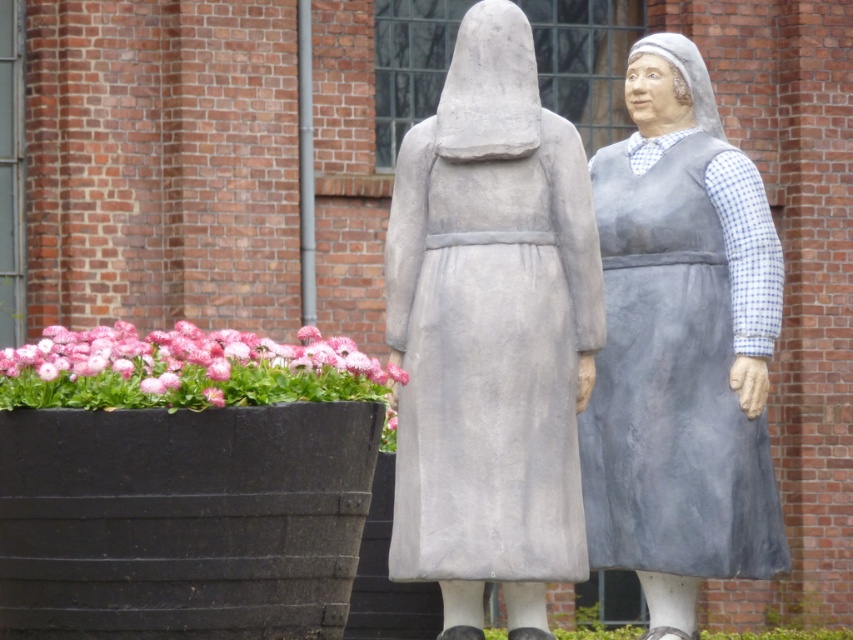
Question: Is gray stone statue at center closer to camera compared to gray fabric dress at center?

Choices:
 (A) yes
 (B) no

Answer: (A)

Question: Estimate the real-world distances between objects in this image. Which object is farther from the gray fabric dress at center?

Choices:
 (A) gray stone statue at center
 (B) pink fabric flowers at lower left

Answer: (B)

Question: Is gray stone statue at center bigger than gray fabric dress at center?

Choices:
 (A) no
 (B) yes

Answer: (B)

Question: Which point is farther to the camera?

Choices:
 (A) (601, 561)
 (B) (184, 348)

Answer: (A)

Question: Which of the following is the farthest from the observer?

Choices:
 (A) gray fabric dress at center
 (B) gray stone statue at center

Answer: (A)

Question: Can you confirm if gray stone statue at center is positioned to the right of gray fabric dress at center?

Choices:
 (A) yes
 (B) no

Answer: (B)